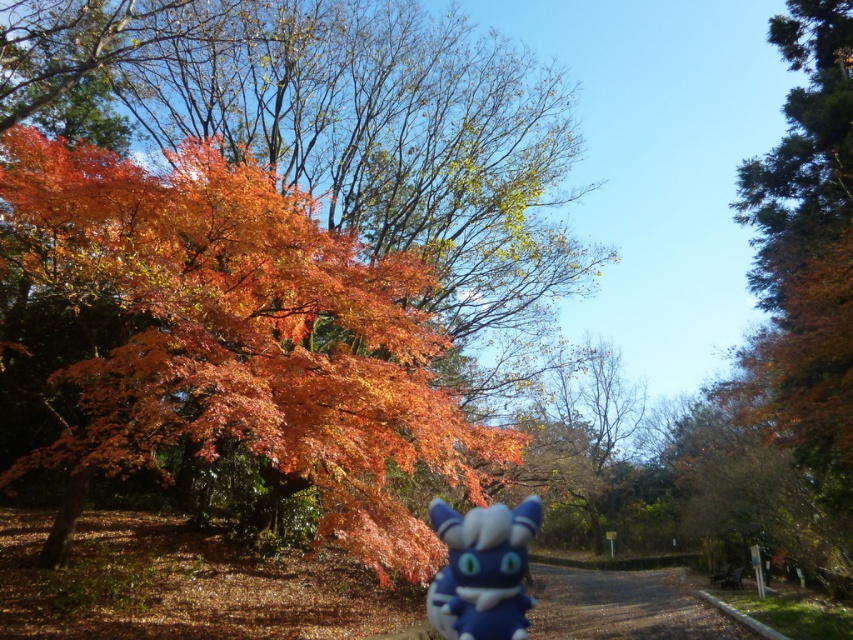
You are a hiker walking along the dirt path in the autumn scene. You see the shiny orange leaves at left and the blue plush toy at center. Which object is located to the left of the other?

The shiny orange leaves at left are to the left of the blue plush toy at center.

You are a child visiting the park and see the shiny orange leaves at left and the blue plush toy at center. Which object is taller?

The blue plush toy at center is taller than the shiny orange leaves at left.